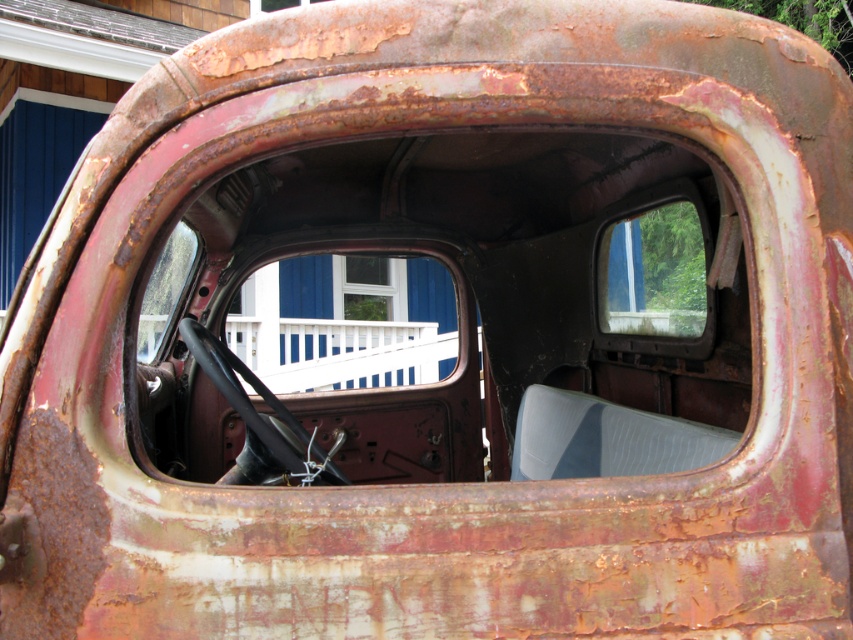
Does white painted wood porch at center have a larger size compared to transparent glass window at center?

Yes, white painted wood porch at center is bigger than transparent glass window at center.

Which is below, white painted wood porch at center or transparent glass window at center?

white painted wood porch at center

Which is in front, point (401, 346) or point (650, 323)?

Point (650, 323) is in front.

This screenshot has width=853, height=640. I want to click on white painted wood porch at center, so click(x=340, y=352).